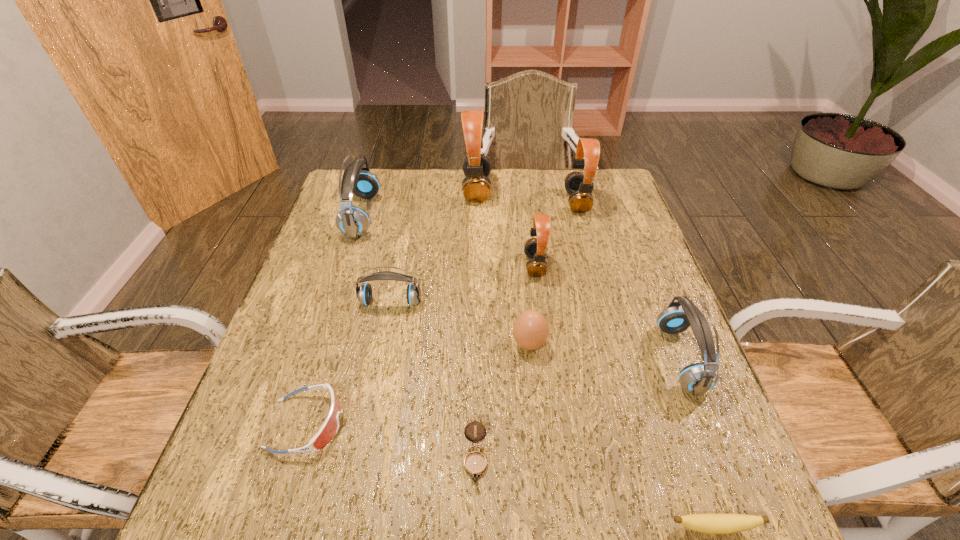
Select which brown headset appears as the second closest to the fourth headset from right to left. Please provide its 2D coordinates. Your answer should be formatted as a tuple, i.e. [(x, y)], where the tuple contains the x and y coordinates of a point satisfying the conditions above.

[(579, 186)]

Where is `brown headset that can be found as the second closest to the farthest blue headset`? The image size is (960, 540). brown headset that can be found as the second closest to the farthest blue headset is located at coordinates (534, 248).

The width and height of the screenshot is (960, 540). I want to click on blue headset that is the second closest to the smallest blue headset, so click(698, 378).

You are a GUI agent. You are given a task and a screenshot of the screen. Output one action in this format:
    pyautogui.click(x=<x>, y=<y>)
    Task: Click on the blue headset that is the second closest to the biggest blue headset
    The width and height of the screenshot is (960, 540).
    Given the screenshot: What is the action you would take?
    pyautogui.click(x=698, y=378)

This screenshot has height=540, width=960. In order to click on free space that satisfies the following two spatial constraints: 1. on the ear cups of the second brown headset from right to left; 2. on the back side of the yellow banana in this screenshot , I will do `click(569, 527)`.

At what (x,y) coordinates should I click in order to perform the action: click on vacant space that satisfies the following two spatial constraints: 1. on the ear cups of the yellow banana; 2. on the left side of the fifth headset from left to right. Please return your answer as a coordinate pair (x, y). Looking at the image, I should click on (666, 527).

Image resolution: width=960 pixels, height=540 pixels. I want to click on blank space that satisfies the following two spatial constraints: 1. on the ear cups of the biggest brown headset; 2. on the ear cups of the second headset from left to right, so click(x=476, y=302).

I want to click on free space in the image that satisfies the following two spatial constraints: 1. on the ear cups of the biggest blue headset; 2. on the back side of the boiled egg, so click(x=321, y=344).

I want to click on vacant region that satisfies the following two spatial constraints: 1. on the front-facing side of the goggles; 2. on the right side of the banana, so click(x=276, y=527).

Find the location of a particular element. This screenshot has width=960, height=540. free space that satisfies the following two spatial constraints: 1. on the ear cups of the second blue headset from left to right; 2. on the left side of the yellow banana is located at coordinates (347, 527).